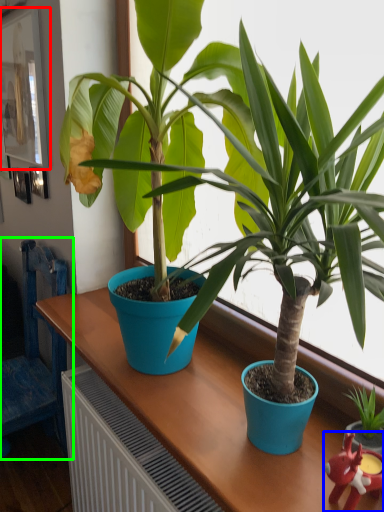
Question: Which object is positioned farthest from picture frame (highlighted by a red box)? Select from toy (highlighted by a blue box) and chair (highlighted by a green box).

Choices:
 (A) toy
 (B) chair

Answer: (A)